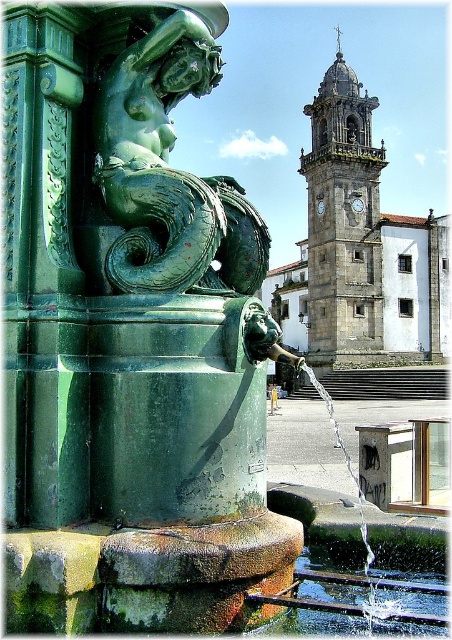
Question: Does gray stone clock tower at upper center appear on the left side of clear liquid water at fountain center?

Choices:
 (A) yes
 (B) no

Answer: (B)

Question: Does green patinated bronze mermaid at center have a larger size compared to gray stone clock tower at upper center?

Choices:
 (A) yes
 (B) no

Answer: (B)

Question: Which object is positioned farthest from the gray stone clock tower at upper center?

Choices:
 (A) green patinated bronze mermaid at center
 (B) clear liquid water at fountain center

Answer: (A)

Question: Among these points, which one is nearest to the camera?

Choices:
 (A) (165, 60)
 (B) (296, 604)

Answer: (B)

Question: Which point is closer to the camera taking this photo?

Choices:
 (A) (351, 296)
 (B) (307, 604)

Answer: (B)

Question: Can you confirm if gray stone clock tower at upper center is wider than clear liquid water at fountain center?

Choices:
 (A) yes
 (B) no

Answer: (A)